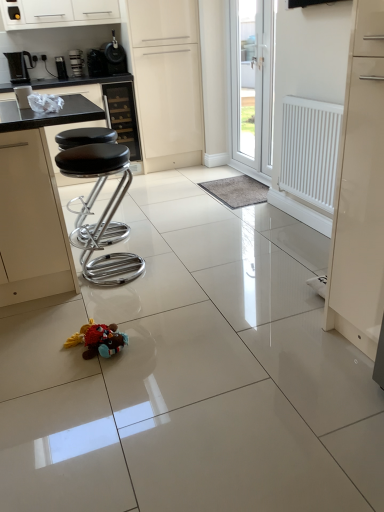
Question: Does white glossy door at upper center, arranged as the 1th door when viewed from the right, have a lesser height compared to white matte door at center, acting as the second door starting from the right?

Choices:
 (A) no
 (B) yes

Answer: (B)

Question: Can you confirm if white glossy door at upper center, the 2th door in the left-to-right sequence, is positioned to the left of white matte door at center, the first door viewed from the left?

Choices:
 (A) no
 (B) yes

Answer: (A)

Question: Is white glossy door at upper center, arranged as the 1th door when viewed from the right, far from white matte door at center, the first door viewed from the left?

Choices:
 (A) yes
 (B) no

Answer: (B)

Question: Can you confirm if white glossy door at upper center, arranged as the 1th door when viewed from the right, is positioned to the right of white matte door at center, the first door viewed from the left?

Choices:
 (A) yes
 (B) no

Answer: (A)

Question: Is white glossy door at upper center, the 2th door in the left-to-right sequence, directly adjacent to white matte door at center, the first door viewed from the left?

Choices:
 (A) no
 (B) yes

Answer: (A)

Question: Relative to black leather bar stools at left, is black leather cabinet at upper center, which is the first cabinetry from bottom to top, in front or behind?

Choices:
 (A) front
 (B) behind

Answer: (B)

Question: Do you think black leather cabinet at upper center, which is the second cabinetry from top to bottom, is within black leather bar stools at left, or outside of it?

Choices:
 (A) outside
 (B) inside

Answer: (A)

Question: Looking at their shapes, would you say black leather cabinet at upper center, which is the first cabinetry from bottom to top, is wider or thinner than black leather bar stools at left?

Choices:
 (A) thin
 (B) wide

Answer: (A)

Question: In the image, is black leather cabinet at upper center, which is the second cabinetry from top to bottom, on the left side or the right side of black leather bar stools at left?

Choices:
 (A) right
 (B) left

Answer: (A)

Question: Based on their positions, is white glossy cabinet at upper center, acting as the 2th cabinetry starting from the bottom, located to the left or right of black leather stool at left?

Choices:
 (A) left
 (B) right

Answer: (A)

Question: Is white glossy cabinet at upper center, placed as the first cabinetry when sorted from top to bottom, inside or outside of black leather stool at left?

Choices:
 (A) outside
 (B) inside

Answer: (A)

Question: In terms of height, does white glossy cabinet at upper center, acting as the 2th cabinetry starting from the bottom, look taller or shorter compared to black leather stool at left?

Choices:
 (A) tall
 (B) short

Answer: (B)

Question: Considering the positions of white glossy cabinet at upper center, placed as the first cabinetry when sorted from top to bottom, and black leather stool at left in the image, is white glossy cabinet at upper center, placed as the first cabinetry when sorted from top to bottom, wider or thinner than black leather stool at left?

Choices:
 (A) thin
 (B) wide

Answer: (A)

Question: Does point (59, 76) appear closer or farther from the camera than point (155, 97)?

Choices:
 (A) closer
 (B) farther

Answer: (A)

Question: In terms of width, does brushed metal coffee machine at upper left, the 2th appliance ordered from the bottom, look wider or thinner when compared to white matte door at center, the first door viewed from the left?

Choices:
 (A) thin
 (B) wide

Answer: (A)